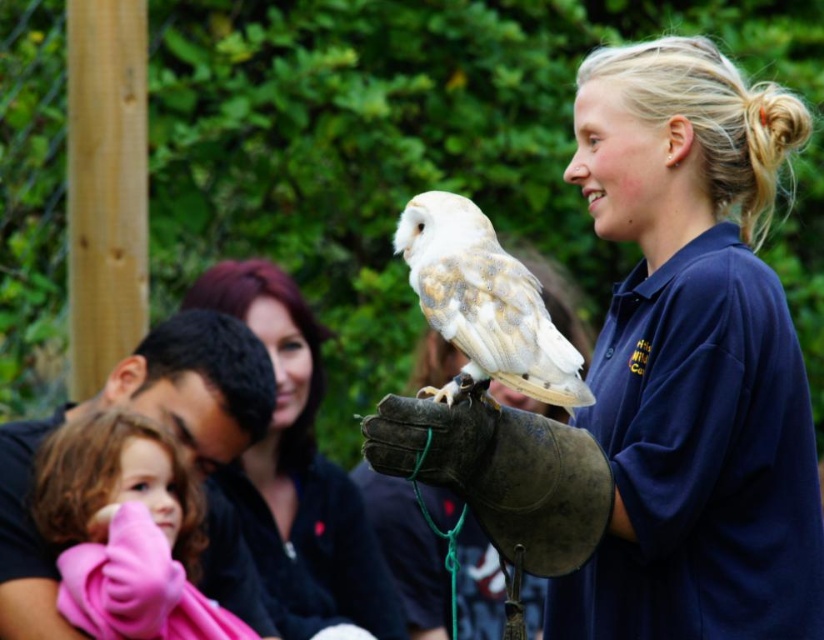
Does smooth black shirt at center appear over white fluffy owl at center?

No.

Is smooth black shirt at center wider than white fluffy owl at center?

Correct, the width of smooth black shirt at center exceeds that of white fluffy owl at center.

Is point (358, 628) farther from viewer compared to point (515, 280)?

Yes, point (358, 628) is behind point (515, 280).

At what (x,y) coordinates should I click in order to perform the action: click on smooth black shirt at center. Please return your answer as a coordinate pair (x, y). Looking at the image, I should click on (298, 476).

Can you confirm if black cotton shirt at left is positioned below white fluffy owl at center?

Indeed, black cotton shirt at left is positioned under white fluffy owl at center.

Is black cotton shirt at left taller than white fluffy owl at center?

Answer: Indeed, black cotton shirt at left has a greater height compared to white fluffy owl at center.

Is point (3, 637) farther from viewer compared to point (537, 289)?

Yes, it is behind point (537, 289).

Image resolution: width=824 pixels, height=640 pixels. I want to click on black cotton shirt at left, so click(148, 416).

Which is below, blue smooth shirt at center or smooth black shirt at center?

smooth black shirt at center is below.

Between blue smooth shirt at center and smooth black shirt at center, which one has less height?

With less height is smooth black shirt at center.

Between point (607, 396) and point (272, 547), which one is positioned in front?

Point (607, 396) is more forward.

The width and height of the screenshot is (824, 640). I want to click on blue smooth shirt at center, so click(659, 380).